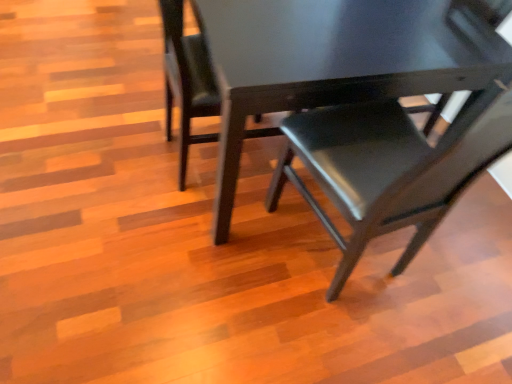
Question: From the image's perspective, is matte black chair at center, which ranks as the second chair in right-to-left order, under matte black chair at center, arranged as the 1th chair when viewed from the right?

Choices:
 (A) yes
 (B) no

Answer: (B)

Question: Can you confirm if matte black chair at center, which ranks as the 2th chair in left-to-right order, is bigger than matte black chair at center, the third chair viewed from the left?

Choices:
 (A) no
 (B) yes

Answer: (B)

Question: Can you confirm if matte black chair at center, which ranks as the second chair in right-to-left order, is shorter than matte black chair at center, arranged as the 1th chair when viewed from the right?

Choices:
 (A) no
 (B) yes

Answer: (B)

Question: Is matte black chair at center, which ranks as the second chair in right-to-left order, further to camera compared to matte black chair at center, the third chair viewed from the left?

Choices:
 (A) yes
 (B) no

Answer: (A)

Question: Can you see matte black chair at center, which ranks as the second chair in right-to-left order, touching matte black chair at center, arranged as the 1th chair when viewed from the right?

Choices:
 (A) no
 (B) yes

Answer: (A)

Question: Is matte black chair at center, which ranks as the second chair in right-to-left order, inside or outside of matte black chair at center, the 3th chair in the right-to-left sequence?

Choices:
 (A) outside
 (B) inside

Answer: (A)

Question: In terms of size, does matte black chair at center, which ranks as the 2th chair in left-to-right order, appear bigger or smaller than matte black chair at center, the 1th chair when ordered from left to right?

Choices:
 (A) small
 (B) big

Answer: (B)

Question: Considering their positions, is matte black chair at center, which ranks as the second chair in right-to-left order, located in front of or behind matte black chair at center, the 1th chair when ordered from left to right?

Choices:
 (A) front
 (B) behind

Answer: (A)

Question: From a real-world perspective, is matte black chair at center, which ranks as the 2th chair in left-to-right order, positioned above or below matte black chair at center, the 1th chair when ordered from left to right?

Choices:
 (A) above
 (B) below

Answer: (B)

Question: Looking at their shapes, would you say matte black chair at center, the third chair viewed from the left, is wider or thinner than matte black chair at center, the 3th chair in the right-to-left sequence?

Choices:
 (A) wide
 (B) thin

Answer: (A)

Question: Is matte black chair at center, arranged as the 1th chair when viewed from the right, spatially inside matte black chair at center, the 1th chair when ordered from left to right, or outside of it?

Choices:
 (A) outside
 (B) inside

Answer: (A)

Question: Considering the positions of matte black chair at center, the third chair viewed from the left, and matte black chair at center, the 3th chair in the right-to-left sequence, in the image, is matte black chair at center, the third chair viewed from the left, bigger or smaller than matte black chair at center, the 3th chair in the right-to-left sequence,?

Choices:
 (A) small
 (B) big

Answer: (B)

Question: Considering the positions of point (343, 107) and point (200, 94), is point (343, 107) closer or farther from the camera than point (200, 94)?

Choices:
 (A) farther
 (B) closer

Answer: (B)

Question: Is matte black chair at center, the third chair viewed from the left, taller or shorter than matte black chair at center, which ranks as the second chair in right-to-left order?

Choices:
 (A) tall
 (B) short

Answer: (A)

Question: Is matte black chair at center, the third chair viewed from the left, to the left or to the right of matte black chair at center, which ranks as the 2th chair in left-to-right order, in the image?

Choices:
 (A) left
 (B) right

Answer: (B)